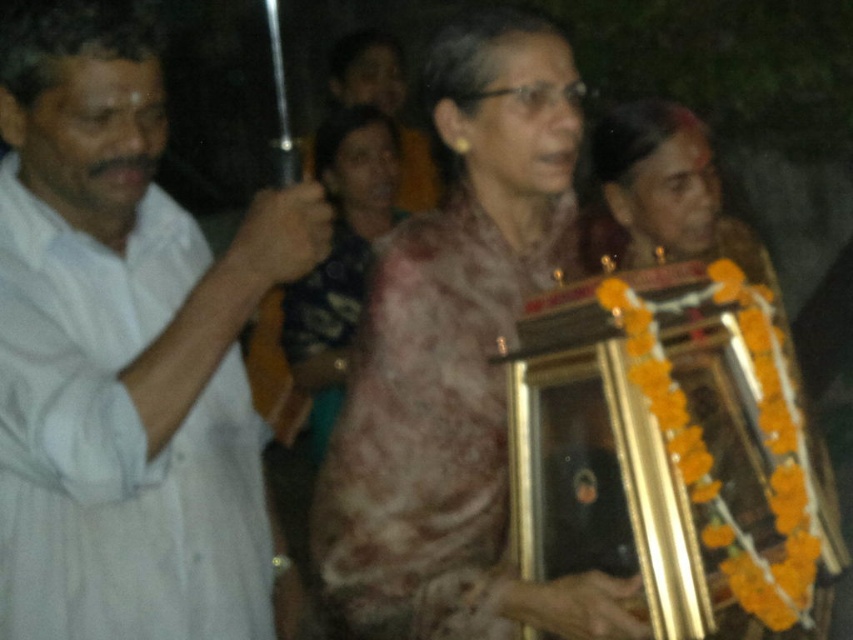
Question: Does pink floral sari at center have a lesser width compared to matte pink saree at center?

Choices:
 (A) no
 (B) yes

Answer: (A)

Question: Estimate the real-world distances between objects in this image. Which object is closer to the white cotton shirt at left?

Choices:
 (A) matte pink saree at center
 (B) pink floral sari at center

Answer: (B)

Question: Which point is closer to the camera?

Choices:
 (A) matte pink saree at center
 (B) white cotton shirt at left
 (C) pink floral sari at center

Answer: (B)

Question: Is white cotton shirt at left further to camera compared to matte pink saree at center?

Choices:
 (A) yes
 (B) no

Answer: (B)

Question: Is white cotton shirt at left to the right of pink floral sari at center from the viewer's perspective?

Choices:
 (A) yes
 (B) no

Answer: (B)

Question: Considering the real-world distances, which object is farthest from the matte pink saree at center?

Choices:
 (A) white cotton shirt at left
 (B) pink floral sari at center

Answer: (B)